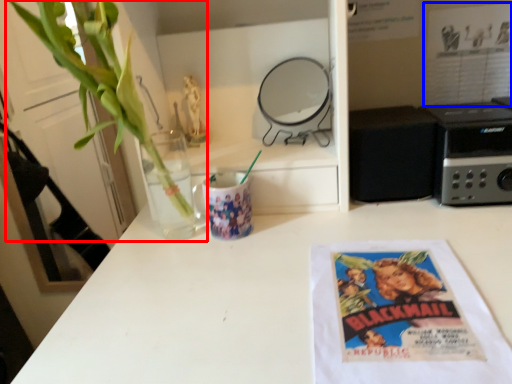
Question: Which object appears farthest to the camera in this image, houseplant (highlighted by a red box) or movie poster (highlighted by a blue box)?

Choices:
 (A) houseplant
 (B) movie poster

Answer: (B)